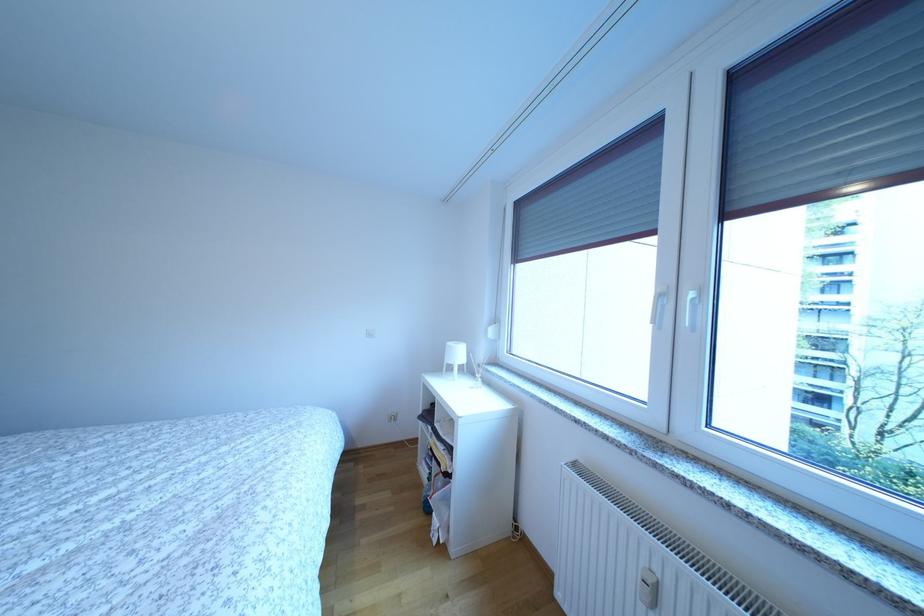
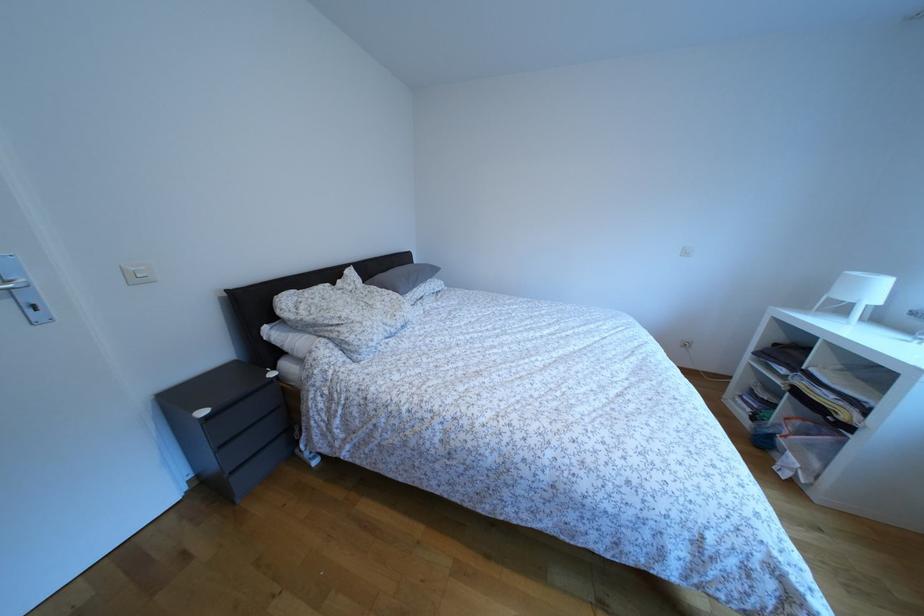
The first image is from the beginning of the video and the second image is from the end. How did the camera likely rotate when shooting the video?

The camera's rotation is toward left-down.